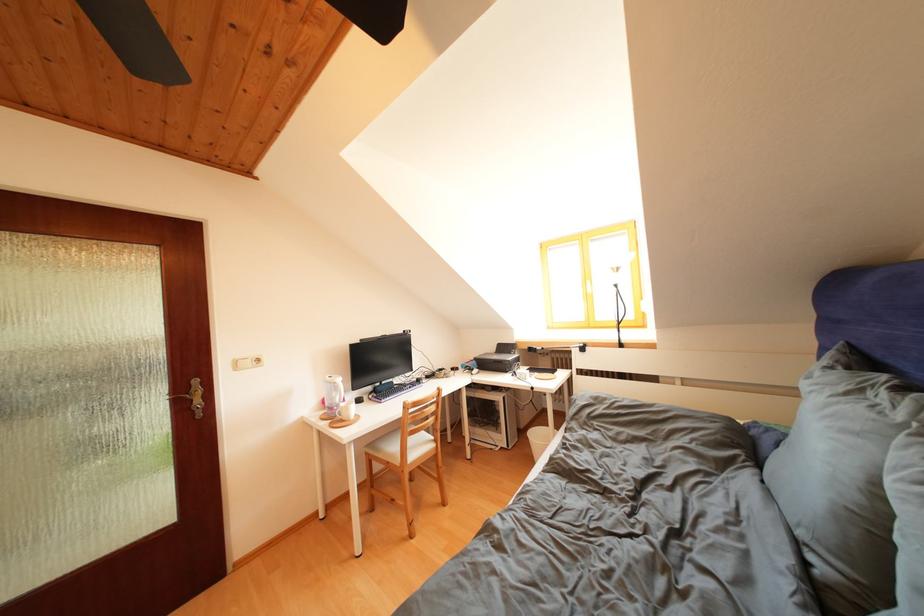
Find where to operat the black printer. Please return your answer as a coordinate pair (x, y).

(499, 359)